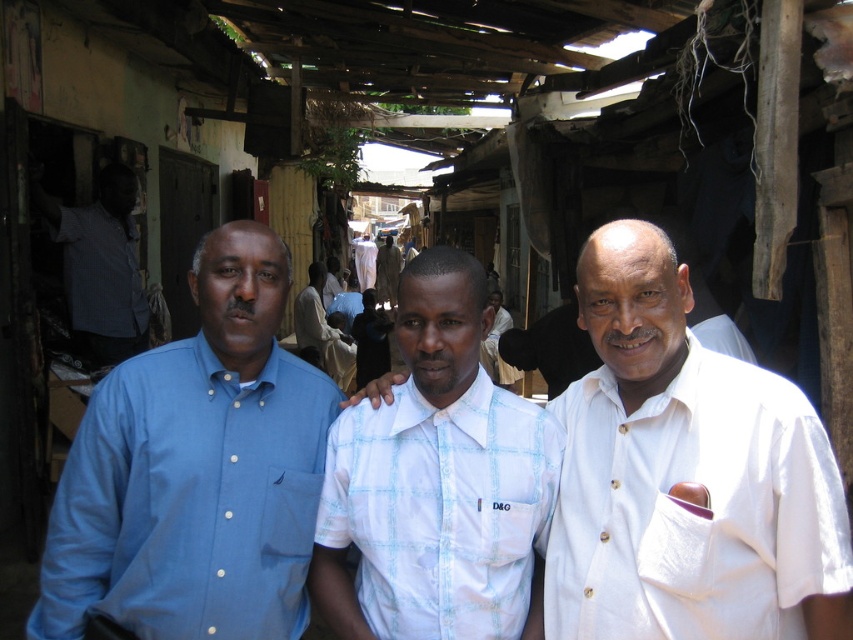
You are standing at the center of the market and see two points marked in the image. The first point is at coordinate point (601,392) and the second is at point (64,262). Which point is closer to you?

Point (601,392) is in front of point (64,262), so the first point is closer to you.